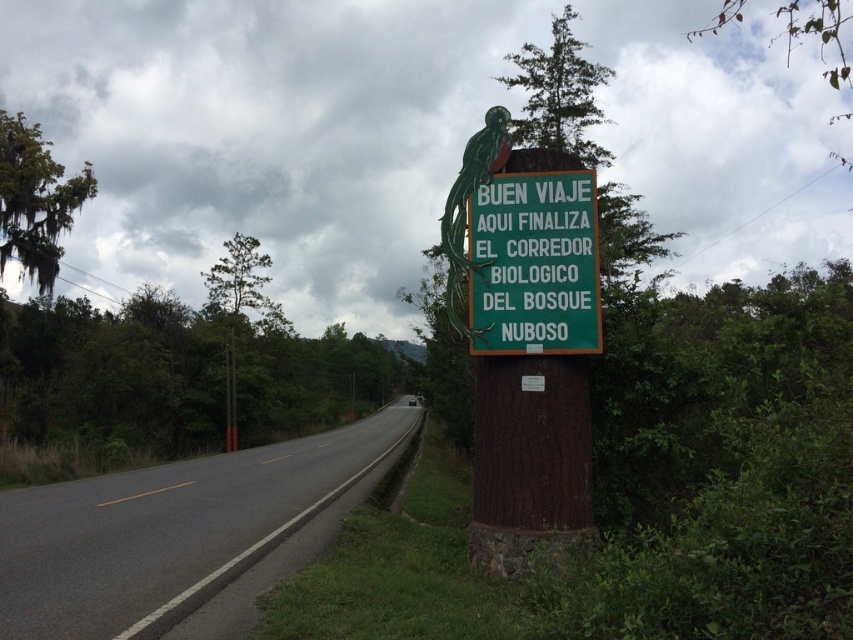
Between asphalt road at center and green matte sign at center, which one appears on the left side from the viewer's perspective?

From the viewer's perspective, asphalt road at center appears more on the left side.

What do you see at coordinates (167, 531) in the screenshot?
I see `asphalt road at center` at bounding box center [167, 531].

Between point (82, 605) and point (560, 209), which one is positioned behind?

The point (560, 209) is behind.

Identify the location of asphalt road at center. (167, 531).